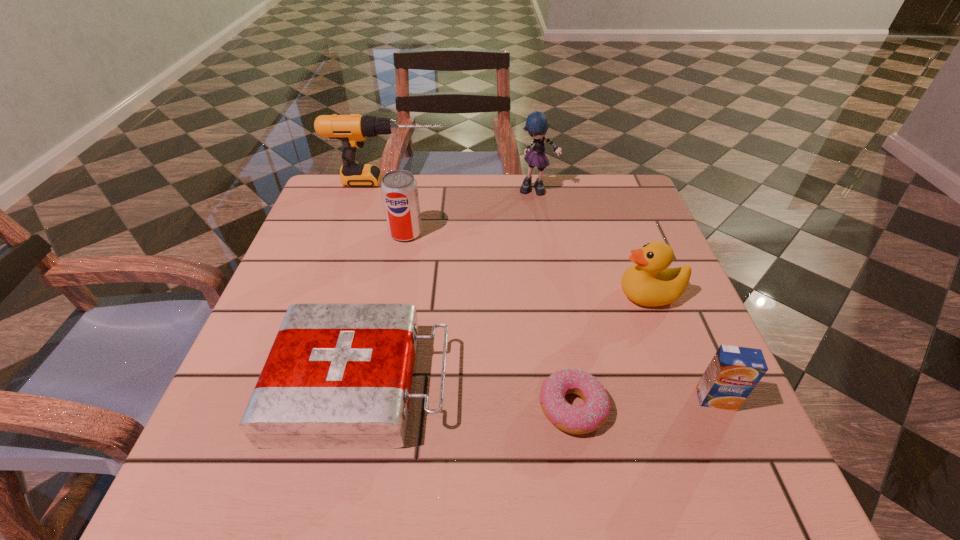
Where is `doughnut that is at the near edge`? Image resolution: width=960 pixels, height=540 pixels. doughnut that is at the near edge is located at coordinates (586, 418).

In order to click on drill that is at the left edge in this screenshot , I will do `click(352, 130)`.

Locate an element on the screen. the first-aid kit present at the left edge is located at coordinates (338, 376).

Where is `duck located in the right edge section of the desktop`? Image resolution: width=960 pixels, height=540 pixels. duck located in the right edge section of the desktop is located at coordinates (650, 282).

Locate an element on the screen. This screenshot has height=540, width=960. orange_juice at the right edge is located at coordinates (733, 373).

Where is `object that is at the far left corner`? object that is at the far left corner is located at coordinates (352, 130).

This screenshot has height=540, width=960. What are the coordinates of `object present at the near left corner` in the screenshot? It's located at (338, 376).

At what (x,y) coordinates should I click in order to perform the action: click on vacant space at the far edge of the desktop. Please return your answer as a coordinate pair (x, y). The image size is (960, 540). Looking at the image, I should click on (535, 188).

Identify the location of free space at the near edge of the desktop. The image size is (960, 540). (582, 466).

In the image, there is a desktop. Where is `vacant space at the left edge`? vacant space at the left edge is located at coordinates (272, 318).